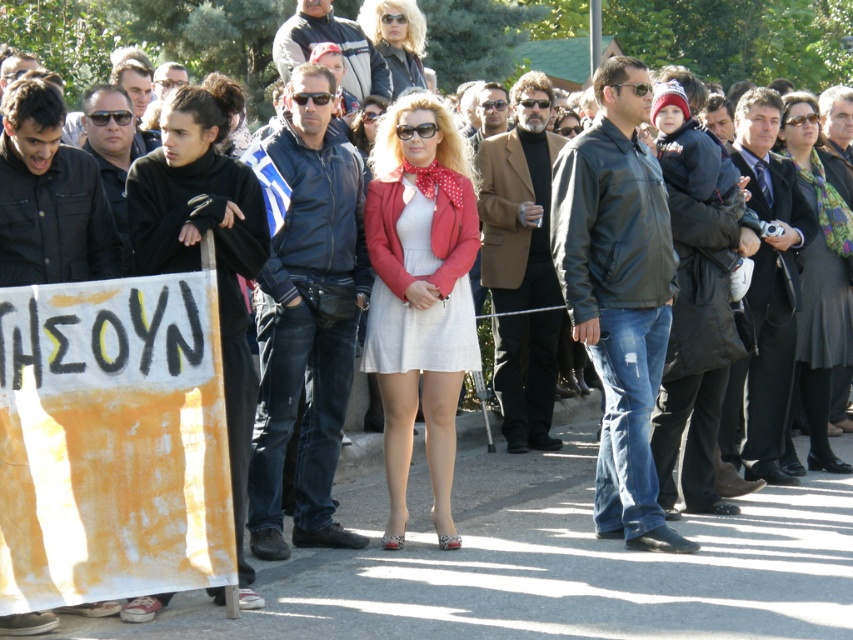
You are a photographer trying to capture a photo of the crowd while standing in front of the scene. You want to ensure both the matte red jacket at center and the dark gray wool coat at center are visible in your shot. Based on their positions, which jacket should you focus on first to include both in the frame?

The matte red jacket at center is positioned on the left side of dark gray wool coat at center, so focusing on the matte red jacket at center first will ensure both are included in the frame.

You are a photographer at the event and want to capture a photo of the matte red jacket at center without the dark gray wool coat at center blocking it. Is this possible given their positions?

The matte red jacket at center is positioned under the dark gray wool coat at center, so the dark gray wool coat at center is above it. Therefore, the dark gray wool coat at center would block the matte red jacket at center in the photo unless the angle is adjusted to avoid the overlap.